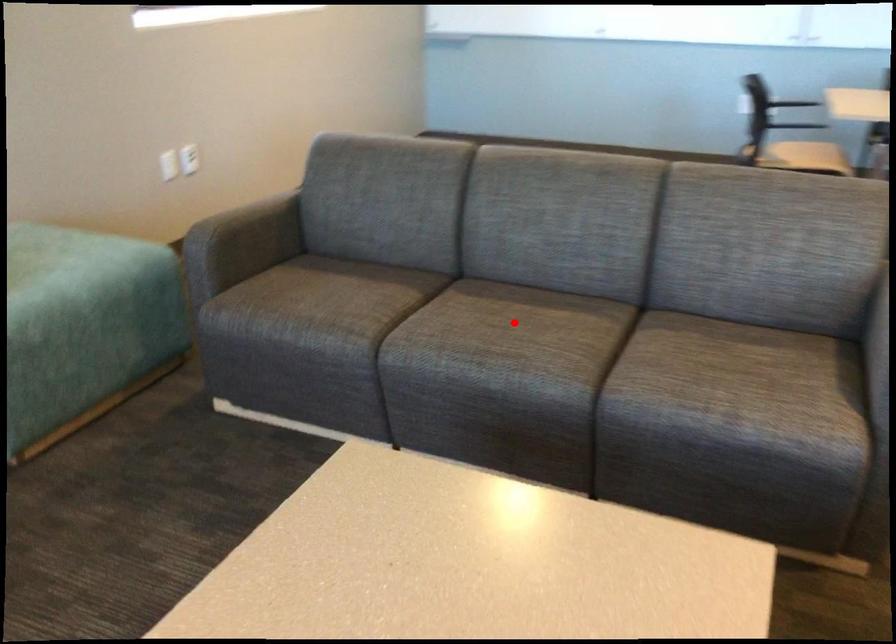
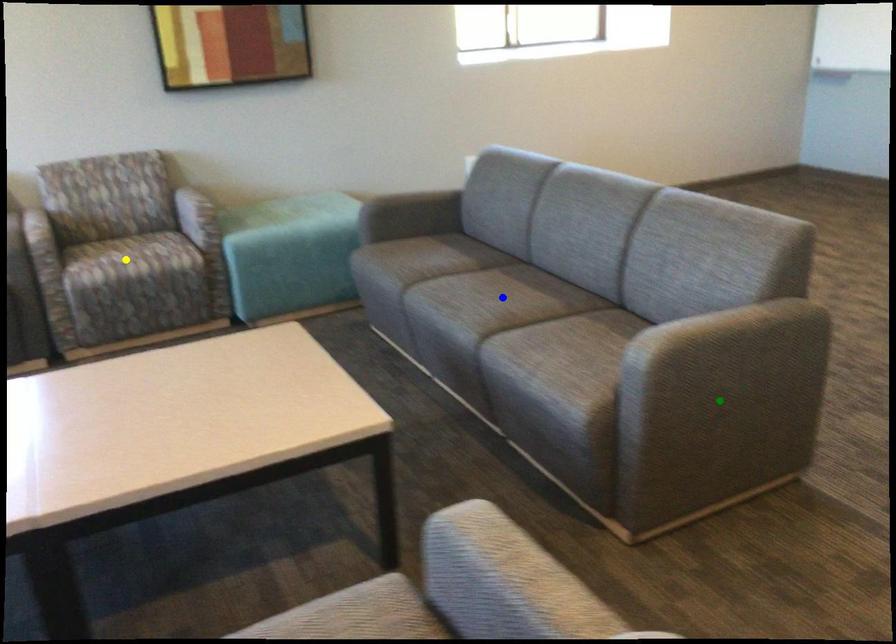
Question: I am providing you with two images of the same scene from different viewpoints. A red point is marked on the first image. You are given multiple points on the second image. Which spot in image 2 lines up with the point in image 1?

Choices:
 (A) yellow point
 (B) blue point
 (C) green point

Answer: (B)